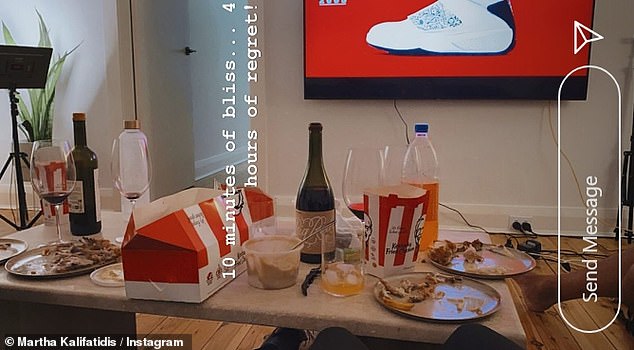
You are a GUI agent. You are given a task and a screenshot of the screen. Output one action in this format:
    pyautogui.click(x=<x>, y=<y>)
    Task: Click on the wood floor
    This screenshot has height=350, width=634.
    Given the screenshot: What is the action you would take?
    pyautogui.click(x=243, y=343), pyautogui.click(x=560, y=340)